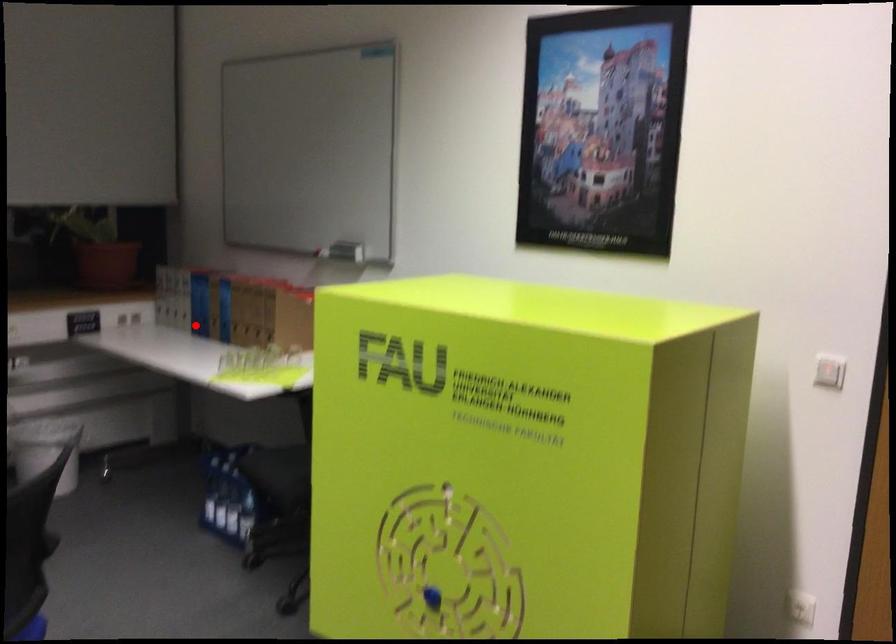
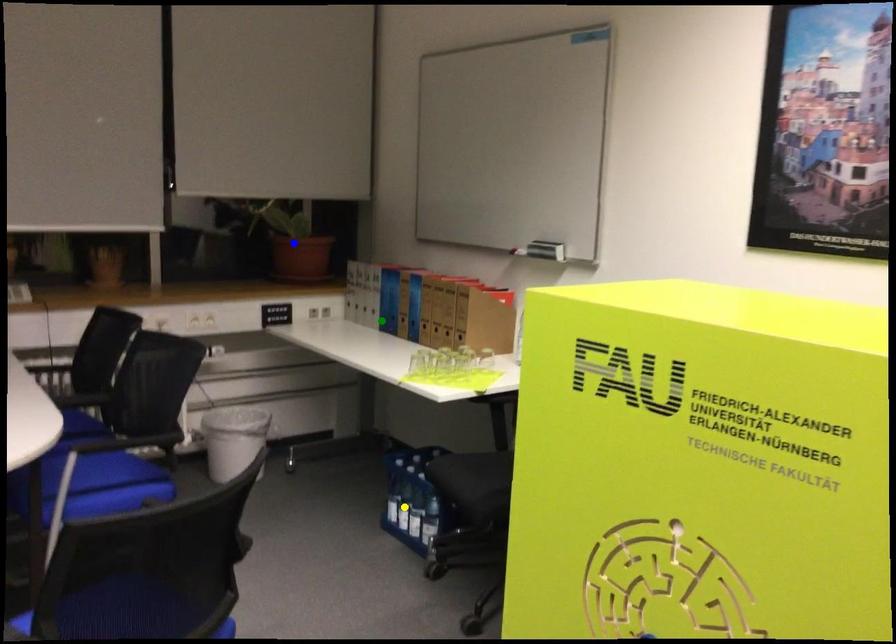
Question: I am providing you with two images of the same scene from different viewpoints. A red point is marked on the first image. You are given multiple points on the second image. In image 2, which mark is for the same physical point as the one in image 1?

Choices:
 (A) green point
 (B) blue point
 (C) yellow point

Answer: (A)